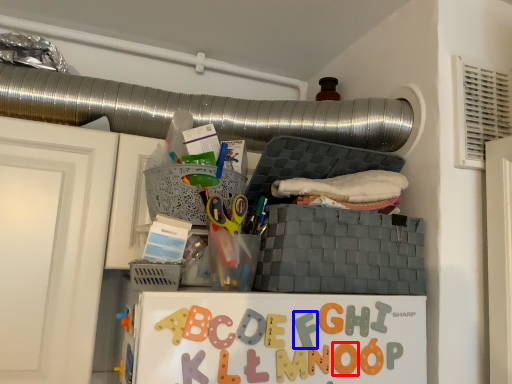
Question: Which object is closer to the camera taking this photo, letter (highlighted by a red box) or alphabet (highlighted by a blue box)?

Choices:
 (A) letter
 (B) alphabet

Answer: (B)